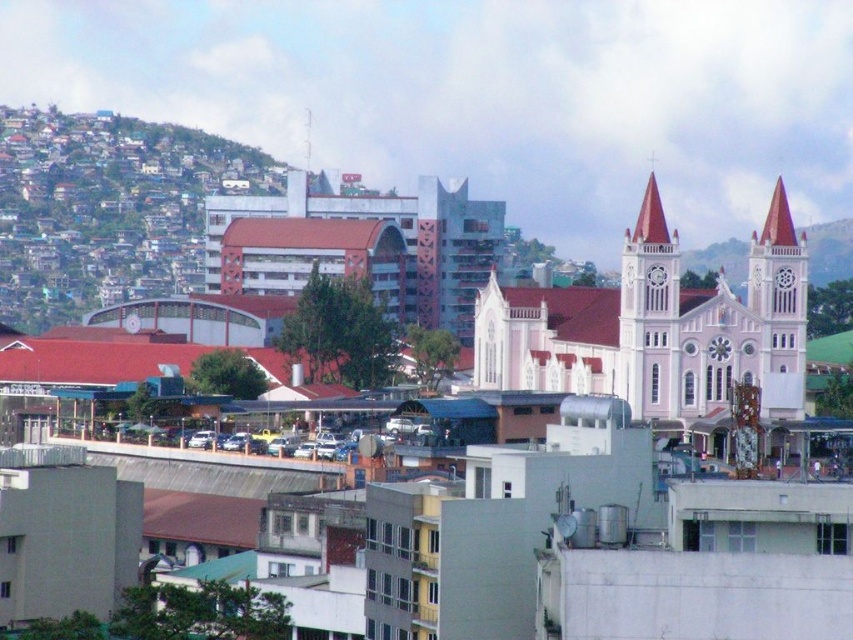
Question: Can you confirm if matte red brick church at center is positioned above white stucco church tower at center-right?

Choices:
 (A) yes
 (B) no

Answer: (A)

Question: Among these points, which one is nearest to the camera?

Choices:
 (A) (677, 259)
 (B) (798, 269)

Answer: (A)

Question: Does matte red brick church at center have a smaller size compared to white stucco church tower at center-right?

Choices:
 (A) no
 (B) yes

Answer: (A)

Question: Does matte red brick church at center have a greater width compared to white stucco clock tower at upper right?

Choices:
 (A) yes
 (B) no

Answer: (A)

Question: Which object appears closest to the camera in this image?

Choices:
 (A) white stucco church tower at center-right
 (B) matte red brick church at center
 (C) white stucco church at center-right

Answer: (C)

Question: Among these points, which one is farthest from the camera?

Choices:
 (A) (627, 243)
 (B) (779, 202)

Answer: (B)